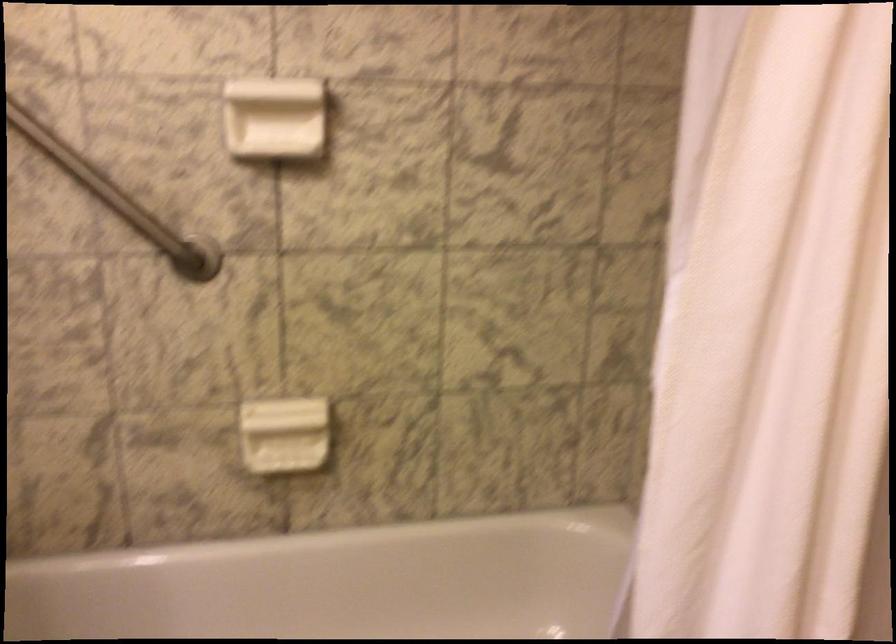
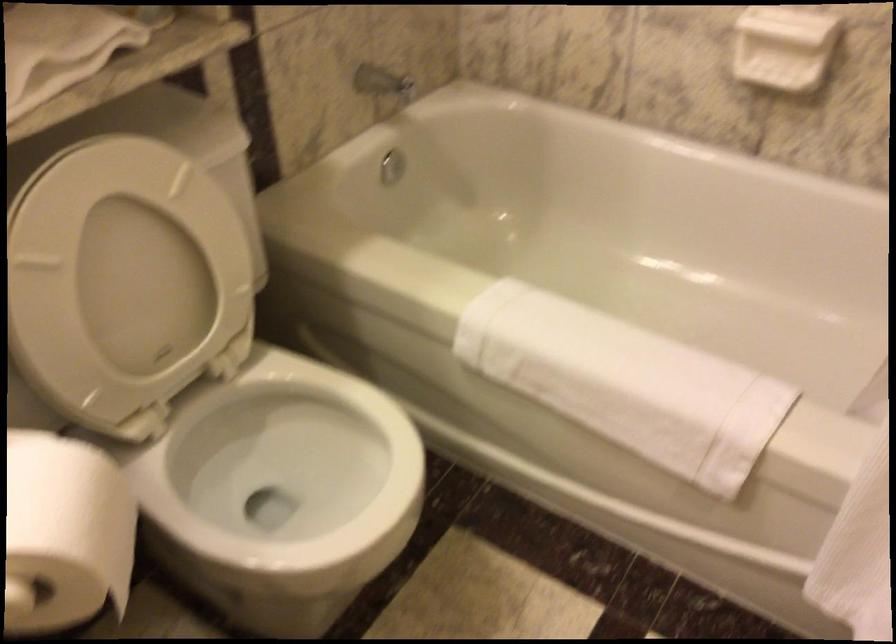
Find the pixel in the second image that matches (288,424) in the first image.

(782, 46)